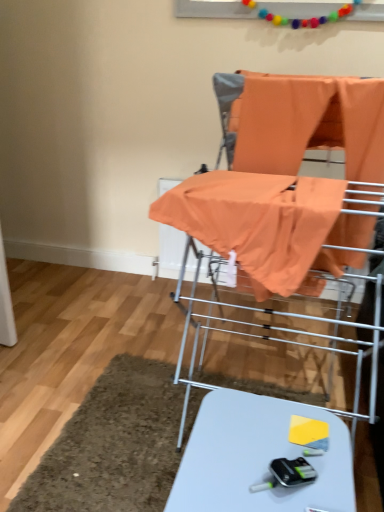
In order to click on orange fabric at center in this screenshot , I will do `click(309, 123)`.

This screenshot has width=384, height=512. Identify the location of orange fabric baby carriage at center. (309, 123).

I want to click on orange fabric at center, so click(309, 123).

Which object is thinner, orange fabric baby carriage at center or white glossy table at lower center?

white glossy table at lower center.

Is orange fabric baby carriage at center not close to white glossy table at lower center?

No, orange fabric baby carriage at center is not far from white glossy table at lower center.

From the picture: Considering their positions, is orange fabric baby carriage at center located in front of or behind white glossy table at lower center?

In the image, orange fabric baby carriage at center appears behind white glossy table at lower center.

Does orange fabric baby carriage at center turn towards white glossy table at lower center?

No, orange fabric baby carriage at center does not turn towards white glossy table at lower center.

From the image's perspective, which one is positioned lower, white glossy table at lower center or orange fabric baby carriage at center?

white glossy table at lower center.

Is white glossy table at lower center positioned beyond the bounds of orange fabric baby carriage at center?

Yes.

Can you see white glossy table at lower center touching orange fabric baby carriage at center?

No, white glossy table at lower center is not with orange fabric baby carriage at center.

Find the location of a particular element. table on the left of the orange fabric baby carriage at center is located at coordinates (258, 458).

Considering the sizes of orange fabric at center and white glossy table at lower center in the image, is orange fabric at center bigger or smaller than white glossy table at lower center?

In the image, orange fabric at center appears to be larger than white glossy table at lower center.

How different are the orientations of orange fabric at center and white glossy table at lower center in degrees?

orange fabric at center and white glossy table at lower center are facing 3.09 degrees away from each other.

Considering the sizes of objects orange fabric at center and white glossy table at lower center in the image provided, who is thinner, orange fabric at center or white glossy table at lower center?

white glossy table at lower center is thinner.

Do you think orange fabric at center is within white glossy table at lower center, or outside of it?

orange fabric at center is not inside white glossy table at lower center, it's outside.

Is orange fabric at center positioned beyond the bounds of orange fabric baby carriage at center?

No, most part of orange fabric at center lies within orange fabric baby carriage at center.

Does orange fabric at center turn towards orange fabric baby carriage at center?

Yes, orange fabric at center is facing orange fabric baby carriage at center.

Who is shorter, orange fabric at center or orange fabric baby carriage at center?

Standing shorter between the two is orange fabric at center.

From a real-world perspective, is orange fabric at center located beneath orange fabric baby carriage at center?

No, from a real-world perspective, orange fabric at center is not beneath orange fabric baby carriage at center.

Based on the photo, from a real-world perspective, is white glossy table at lower center over orange fabric at center?

No, from a real-world perspective, white glossy table at lower center is not on top of orange fabric at center.

I want to click on table below the orange fabric at center (from a real-world perspective), so click(258, 458).

Can you confirm if white glossy table at lower center is shorter than orange fabric at center?

Yes, white glossy table at lower center is shorter than orange fabric at center.

Is white glossy table at lower center facing towards orange fabric at center?

No, white glossy table at lower center does not turn towards orange fabric at center.

Considering the positions of objects orange fabric baby carriage at center and orange fabric at center in the image provided, who is behind, orange fabric baby carriage at center or orange fabric at center?

orange fabric at center is further away from the camera.

This screenshot has width=384, height=512. Identify the location of baby carriage lying in front of the orange fabric at center. (309, 123).

Is orange fabric baby carriage at center directly adjacent to orange fabric at center?

Yes, orange fabric baby carriage at center is in contact with orange fabric at center.

Locate an element on the screen. baby carriage on the right of white glossy table at lower center is located at coordinates (309, 123).

Locate an element on the screen. table below the orange fabric baby carriage at center (from the image's perspective) is located at coordinates (258, 458).

Looking at the image, which one is located closer to white glossy table at lower center, orange fabric at center or orange fabric baby carriage at center?

orange fabric baby carriage at center is closer to white glossy table at lower center.

From the image, which object appears to be farther from orange fabric baby carriage at center, white glossy table at lower center or orange fabric at center?

Among the two, white glossy table at lower center is located further to orange fabric baby carriage at center.

From the image, which object appears to be farther from orange fabric baby carriage at center, orange fabric at center or white glossy table at lower center?

The object further to orange fabric baby carriage at center is white glossy table at lower center.

Estimate the real-world distances between objects in this image. Which object is further from orange fabric at center, orange fabric baby carriage at center or white glossy table at lower center?

The object further to orange fabric at center is white glossy table at lower center.

Based on their spatial positions, is orange fabric baby carriage at center or orange fabric at center further from white glossy table at lower center?

orange fabric at center.

Looking at the image, which one is located further to orange fabric at center, white glossy table at lower center or orange fabric baby carriage at center?

white glossy table at lower center is positioned further to the anchor orange fabric at center.

Where is `baby carriage between orange fabric at center and white glossy table at lower center from top to bottom`? The height and width of the screenshot is (512, 384). baby carriage between orange fabric at center and white glossy table at lower center from top to bottom is located at coordinates (309, 123).